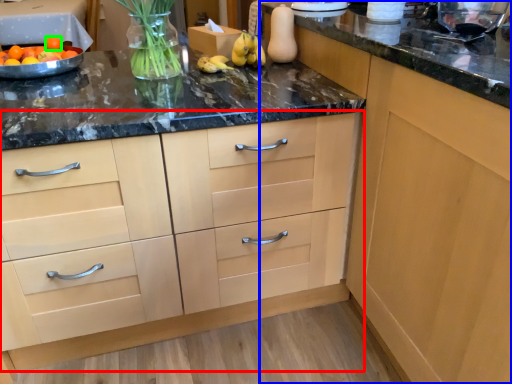
Question: Considering the real-world distances, which object is farthest from cabinetry (highlighted by a red box)? cabinetry (highlighted by a blue box) or tangerine (highlighted by a green box)?

Choices:
 (A) cabinetry
 (B) tangerine

Answer: (B)